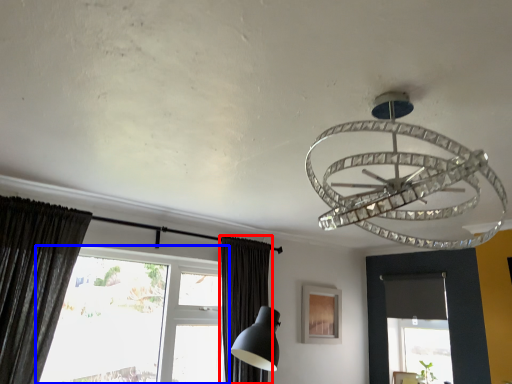
Question: Which object is further to the camera taking this photo, curtain (highlighted by a red box) or window (highlighted by a blue box)?

Choices:
 (A) curtain
 (B) window

Answer: (A)